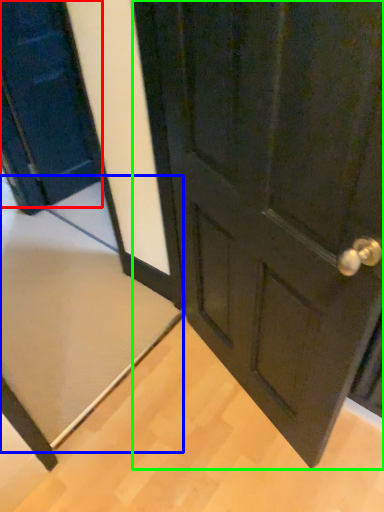
Question: Which object is the closest to the door (highlighted by a red box)? Choose among these: doormat (highlighted by a blue box) or door (highlighted by a green box).

Choices:
 (A) doormat
 (B) door

Answer: (A)